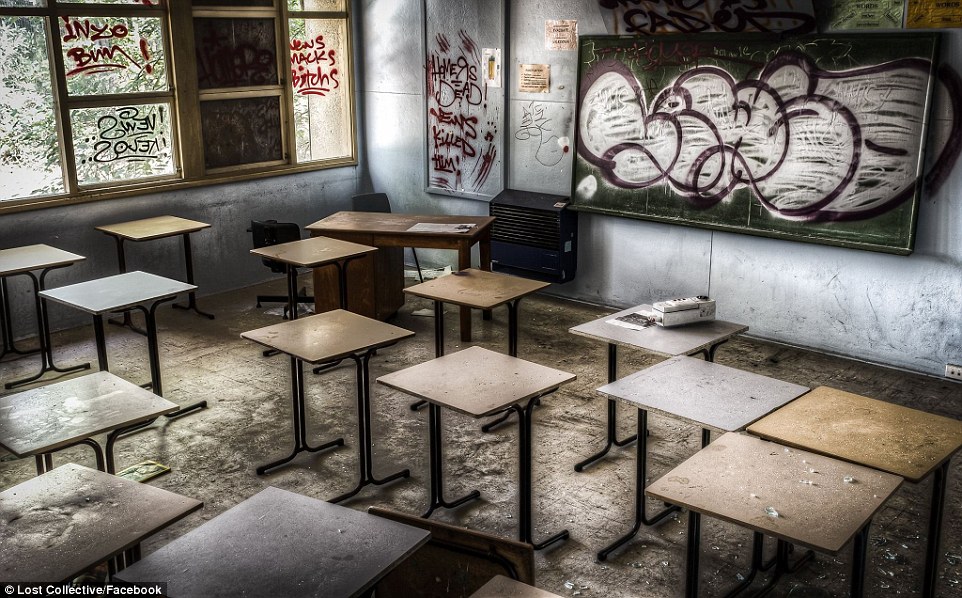
Find the location of `blackboard`. blackboard is located at coordinates (742, 215).